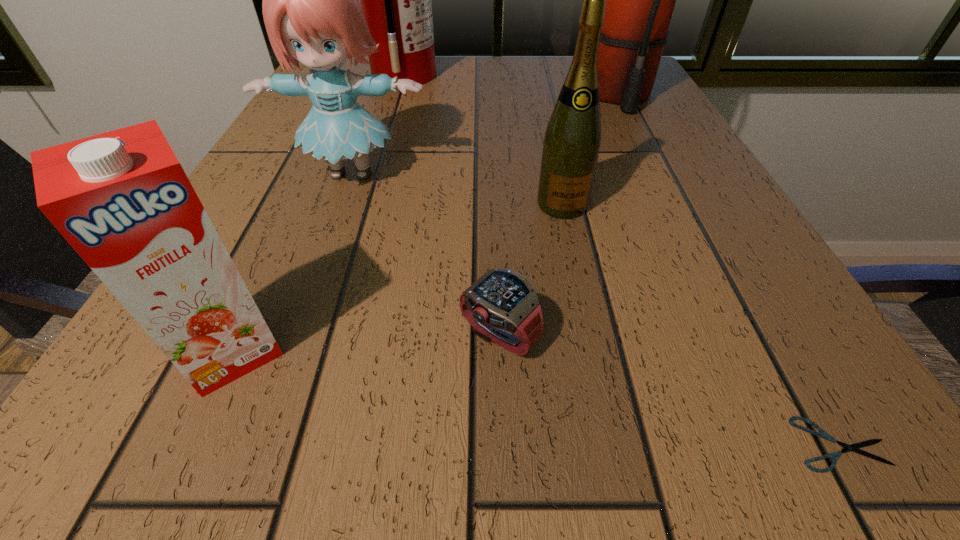
Find the location of a particular element. blank region between the left fire extinguisher and the fifth object from left to right is located at coordinates (483, 140).

Find the location of a particular element. unoccupied area between the doll and the carton is located at coordinates (292, 261).

The width and height of the screenshot is (960, 540). Find the location of `free space between the right fire extinguisher and the carton`. free space between the right fire extinguisher and the carton is located at coordinates (425, 222).

The image size is (960, 540). I want to click on vacant space in between the wine bottle and the doll, so click(x=457, y=188).

Locate an element on the screen. This screenshot has height=540, width=960. free spot between the shortest object and the doll is located at coordinates (595, 308).

This screenshot has width=960, height=540. I want to click on unoccupied area between the doll and the carton, so click(x=292, y=261).

You are a GUI agent. You are given a task and a screenshot of the screen. Output one action in this format:
    pyautogui.click(x=<x>, y=<y>)
    Task: Click on the free area in between the shears and the left fire extinguisher
    The width and height of the screenshot is (960, 540).
    Given the screenshot: What is the action you would take?
    pyautogui.click(x=622, y=260)

Locate an element on the screen. The width and height of the screenshot is (960, 540). the second closest object to the right fire extinguisher is located at coordinates (395, 0).

This screenshot has width=960, height=540. I want to click on the closest object relative to the left fire extinguisher, so (x=312, y=15).

Locate an element on the screen. The image size is (960, 540). free space that satisfies the following two spatial constraints: 1. on the front-facing side of the nearest object; 2. on the left side of the wine bottle is located at coordinates (612, 444).